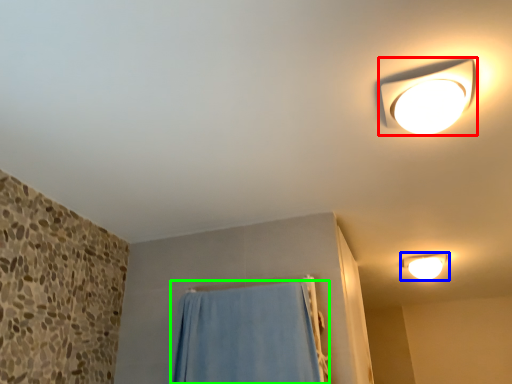
Question: Based on their relative distances, which object is farther from lamp (highlighted by a red box)? Choose from lamp (highlighted by a blue box) and curtain (highlighted by a green box).

Choices:
 (A) lamp
 (B) curtain

Answer: (A)